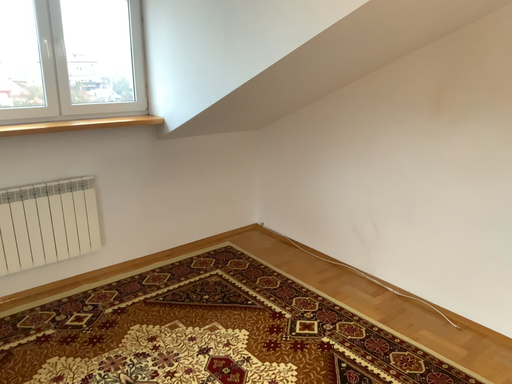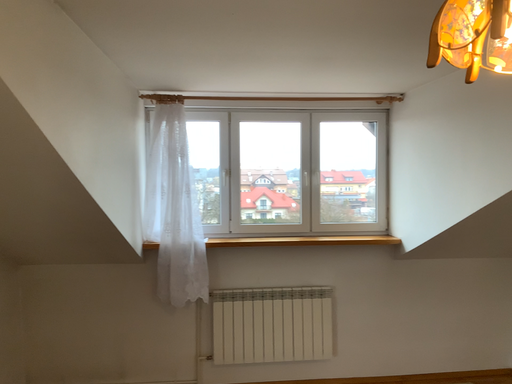
Question: How did the camera likely rotate when shooting the video?

Choices:
 (A) rotated right
 (B) rotated left

Answer: (B)